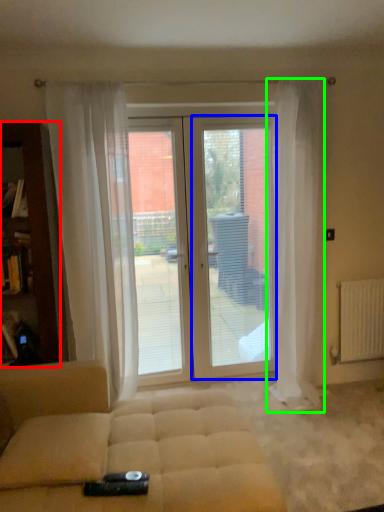
Question: Which is nearer to the cabinetry (highlighted by a red box)? screen door (highlighted by a blue box) or curtain (highlighted by a green box).

Choices:
 (A) screen door
 (B) curtain

Answer: (A)